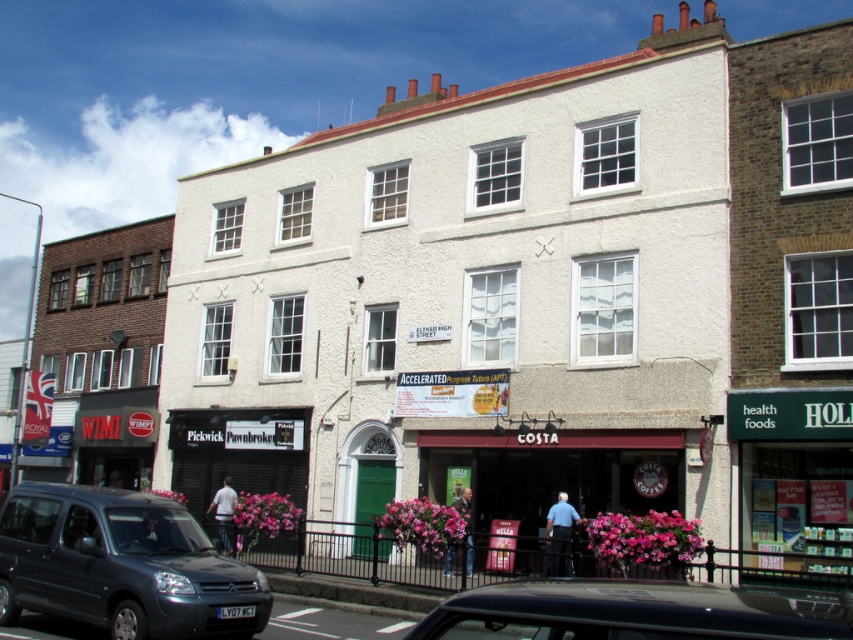
Question: Where is matte black car at lower left located in relation to black matte car at lower center in the image?

Choices:
 (A) right
 (B) left

Answer: (B)

Question: Is the position of matte black car at lower left less distant than that of brown wooden costa coffee shop at center?

Choices:
 (A) no
 (B) yes

Answer: (B)

Question: Which of the following is the closest to the observer?

Choices:
 (A) brown wooden costa coffee shop at center
 (B) matte black car at lower left
 (C) black matte car at lower center

Answer: (C)

Question: Does black matte car at lower center appear under brown wooden costa coffee shop at center?

Choices:
 (A) yes
 (B) no

Answer: (A)

Question: Which point is farther to the camera?

Choices:
 (A) matte black car at lower left
 (B) brown wooden costa coffee shop at center
 (C) black matte car at lower center

Answer: (B)

Question: Which of the following is the farthest from the observer?

Choices:
 (A) black matte car at lower center
 (B) brown wooden costa coffee shop at center
 (C) matte black car at lower left

Answer: (B)